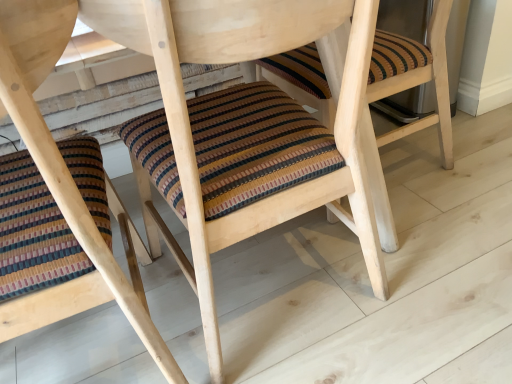
Find the location of a particular element. vacant space to the right of striped fabric cushion at center, which is counted as the 1th chair, starting from the right is located at coordinates (438, 263).